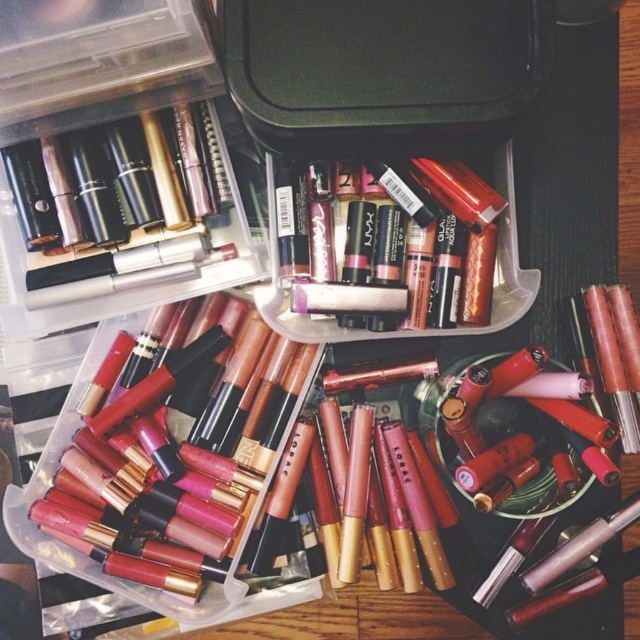
Question: In this image, where is matte gold lipstick at lower left located relative to metallic gold lipstick at center?

Choices:
 (A) right
 (B) left

Answer: (B)

Question: Does matte gold lipstick at lower left appear over metallic gold lipstick at center?

Choices:
 (A) yes
 (B) no

Answer: (B)

Question: Can you confirm if matte gold lipstick at lower left is positioned to the right of metallic gold lipstick at center?

Choices:
 (A) yes
 (B) no

Answer: (B)